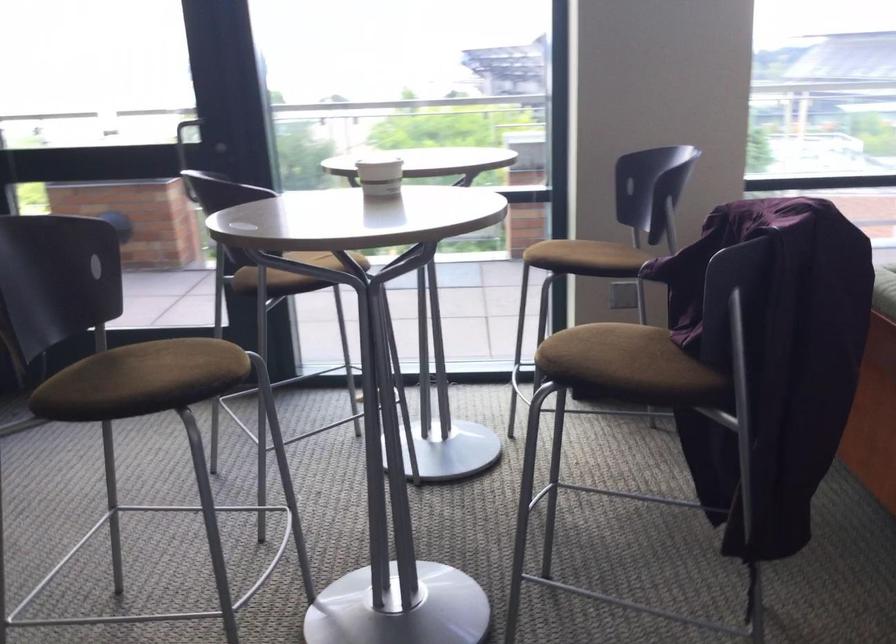
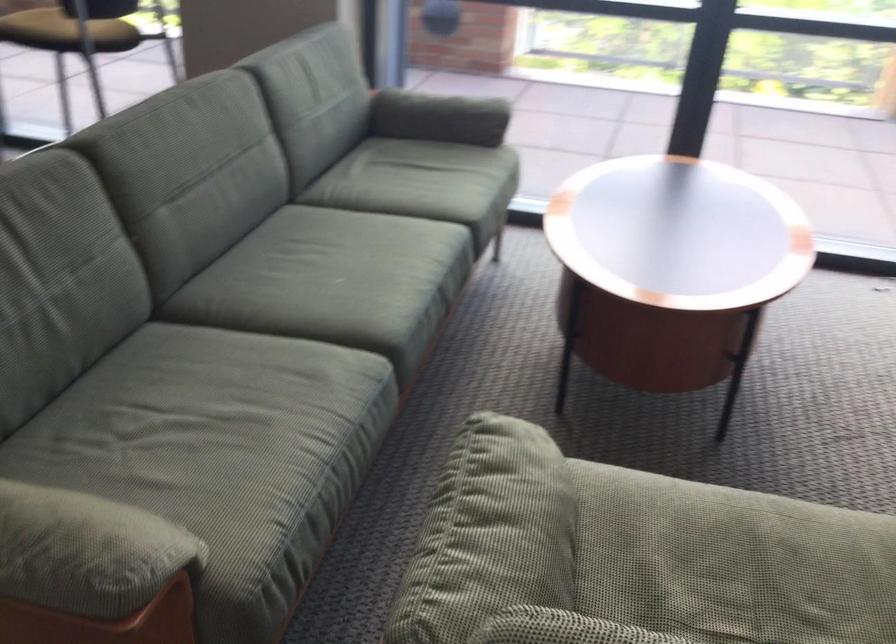
Question: What movement of the cameraman would produce the second image?

Choices:
 (A) Left
 (B) Right
 (C) Forward
 (D) Backward

Answer: (B)